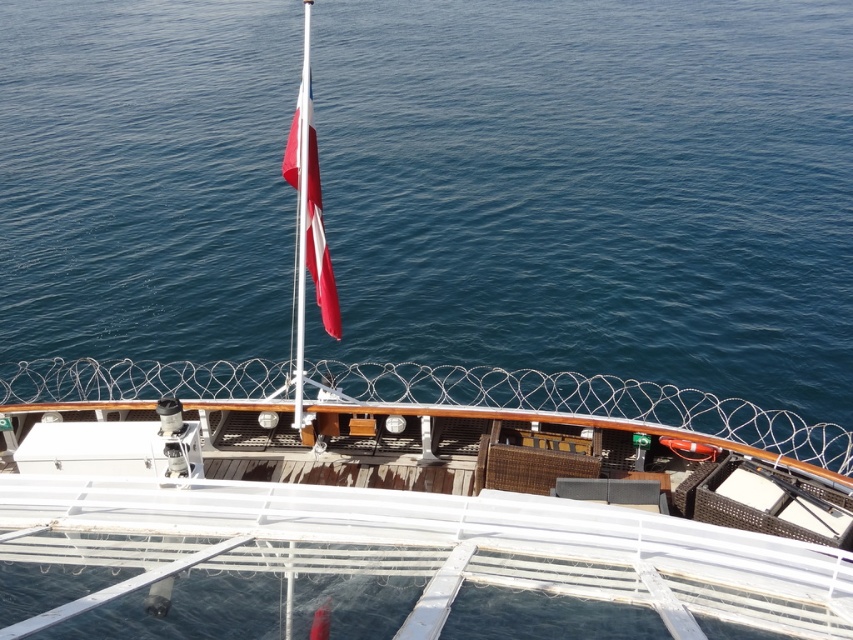
You are standing on the ship deck and want to know if the blue water at center is wider than the red fabric flag at center. Can you tell me?

The blue water at center is wider than the red fabric flag at center.

You are a sailor on the ship deck. You need to determine which object takes up more space in your view between the blue water at center and the red fabric flag at center. Which one is it?

The blue water at center is larger in size than the red fabric flag at center, so the blue water at center takes up more space in the view.

You are standing on the ship deck and want to know which object is taller between the blue water at center and the red fabric flag at center. Which one is taller?

The blue water at center is taller than the red fabric flag at center according to the description.